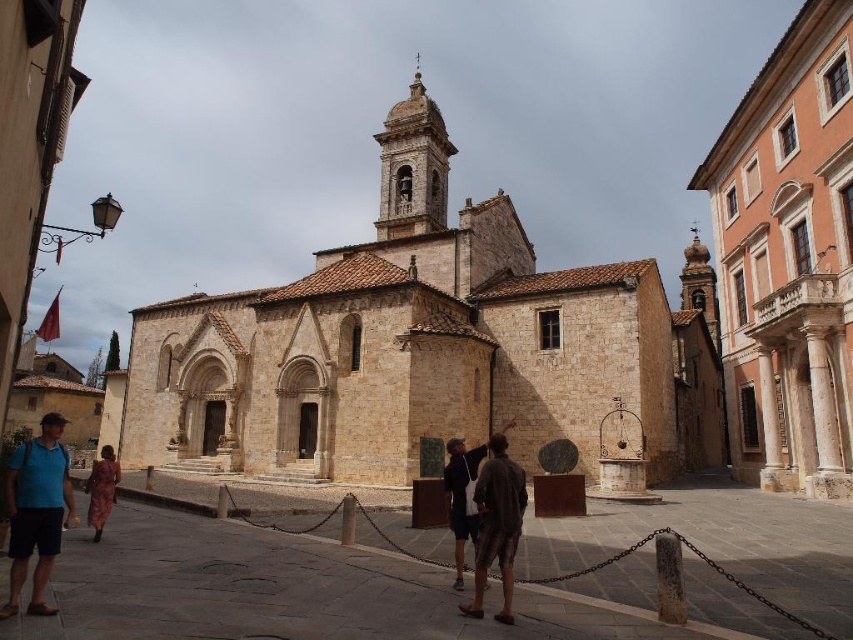
You are a tourist standing in the town square and see the beige stone church at center and the leather coat at lower left. Which object is closer to you?

The leather coat at lower left is behind the beige stone church at center, so the beige stone church at center is closer to you.

You are a tourist standing in the town square in front of the historic stone church. You see two people dressed in brown textured clothing at center and leather coat at lower left. Which person is closer to you?

The brown textured clothing at center is closer to you because it is in front of the leather coat at lower left.

You are a tourist standing in the town square and see the brown textured clothing at center and the leather coat at lower left. Which person is shorter?

The brown textured clothing at center has a lesser height compared to the leather coat at lower left, so the person in the brown textured clothing at center is shorter.